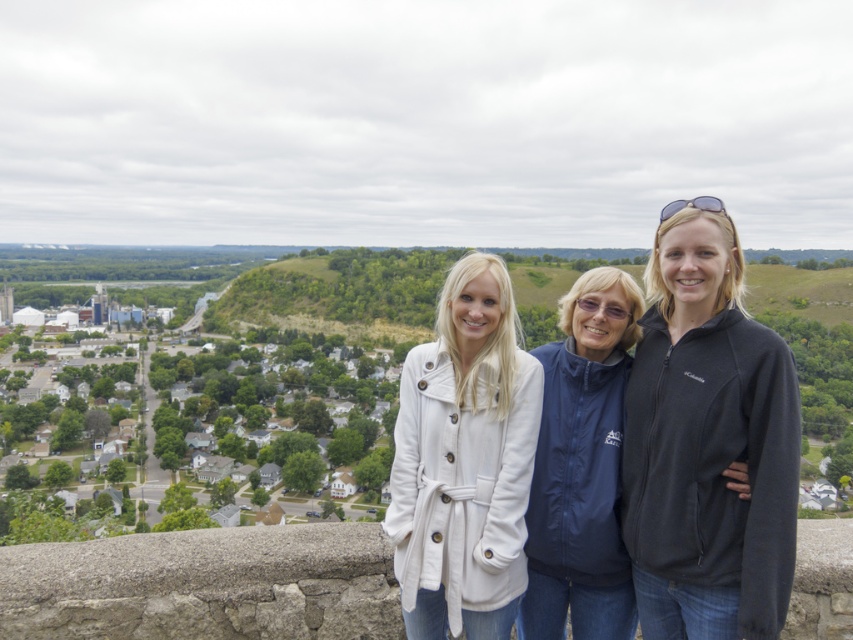
Between point (715, 200) and point (758, 621), which one is positioned in front?

Point (758, 621)

Does white fleece jacket at center appear on the right side of black fleece jacket at center?

In fact, white fleece jacket at center is to the left of black fleece jacket at center.

Who is more distant from viewer, [648,374] or [680,586]?

Point [648,374]

Identify the location of white fleece jacket at center. (706, 444).

Measure the distance from black fleece jacket at center to white fleece coat at center.

A distance of 11.83 meters exists between black fleece jacket at center and white fleece coat at center.

Looking at this image, is the position of black fleece jacket at center more distant than that of white fleece coat at center?

That is False.

Who is more distant from viewer, (683, 612) or (485, 621)?

The point (485, 621) is behind.

This screenshot has height=640, width=853. What are the coordinates of `black fleece jacket at center` in the screenshot? It's located at (706, 445).

Describe the element at coordinates (706, 444) in the screenshot. I see `white fleece jacket at center` at that location.

The height and width of the screenshot is (640, 853). Find the location of `white fleece jacket at center`. white fleece jacket at center is located at coordinates (706, 444).